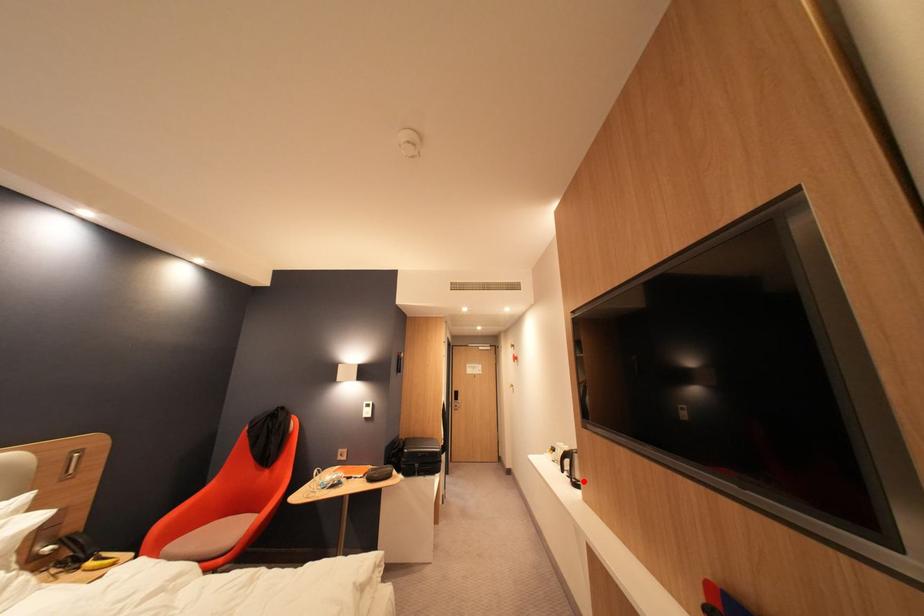
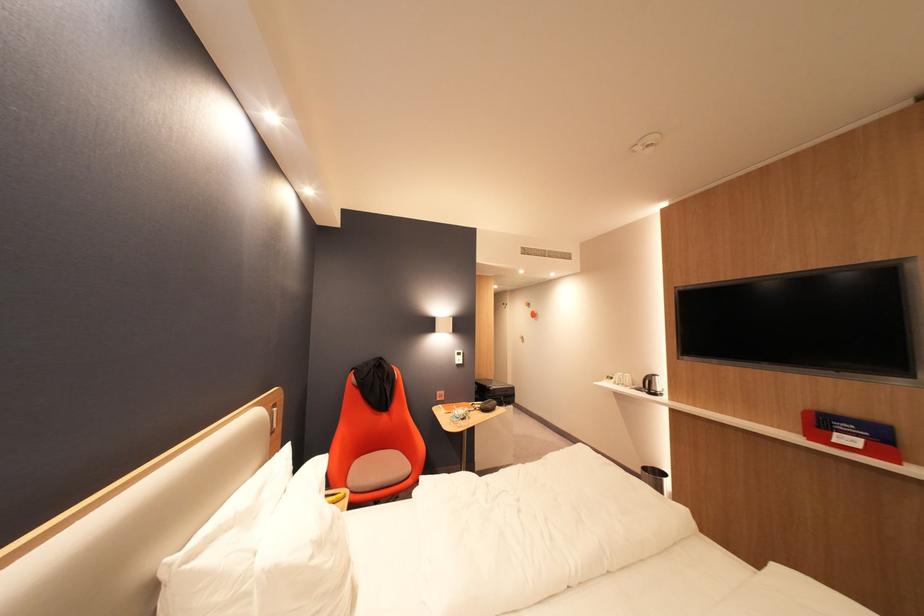
Where in the second image is the point corresponding to the highlighted location from the first image?

(662, 392)